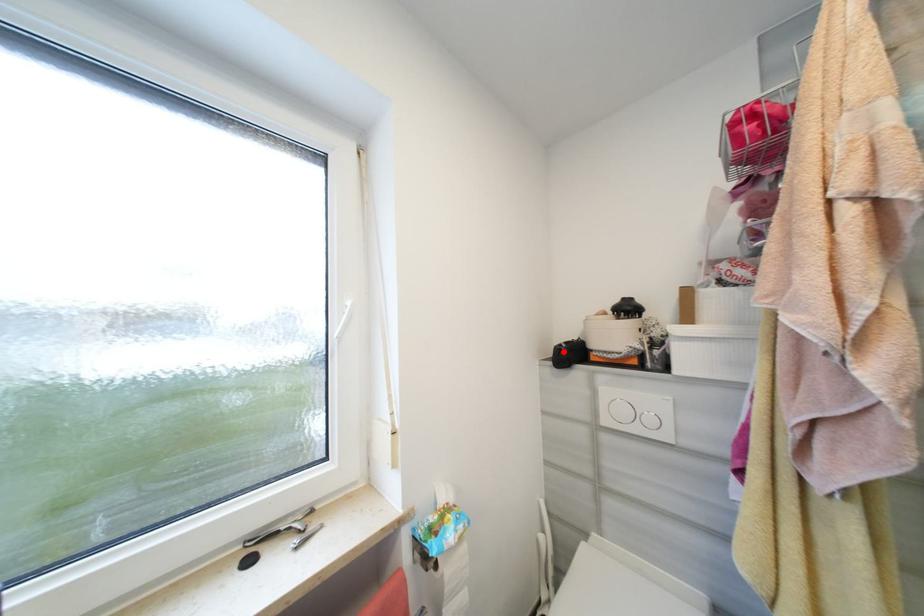
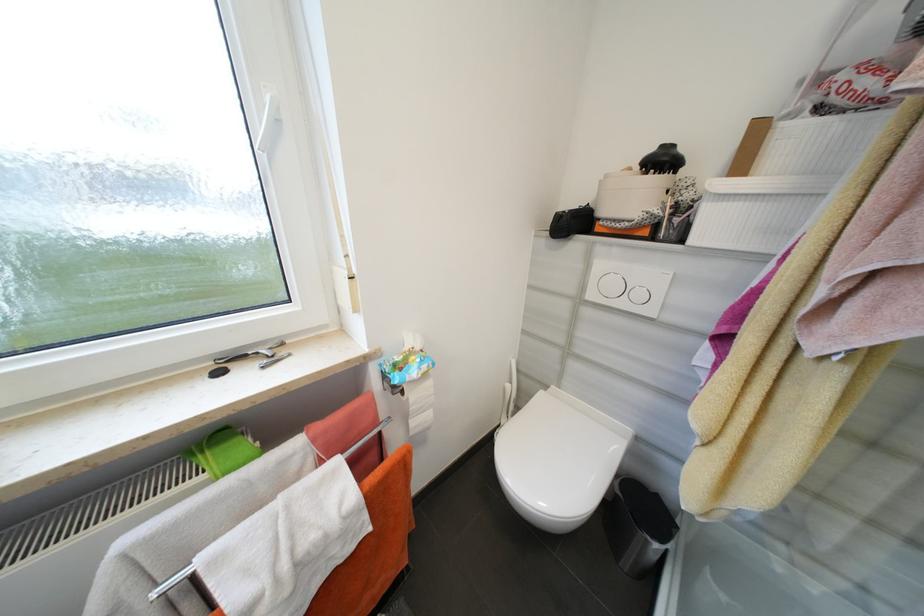
Where in the second image is the point corresponding to the highlighted location from the first image?

(565, 217)